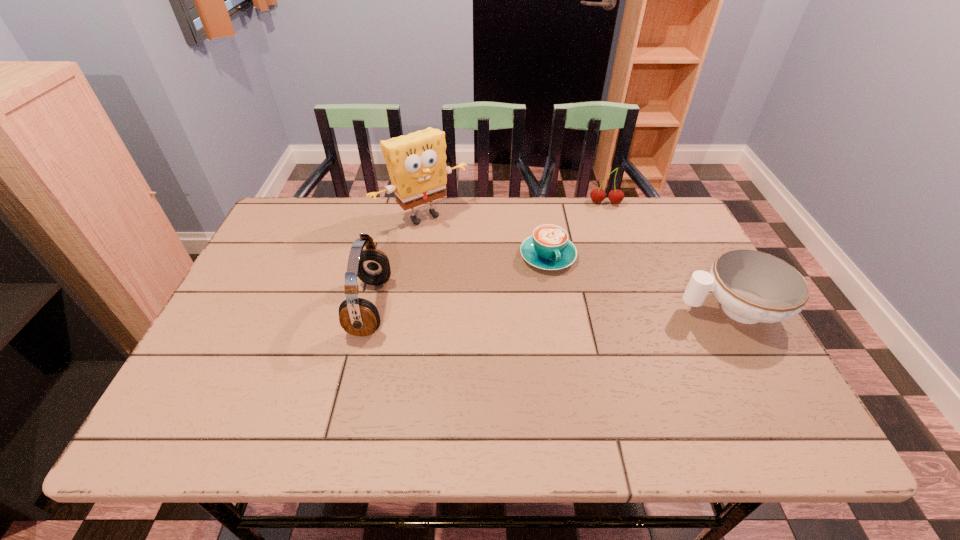
This screenshot has width=960, height=540. Find the location of `sponge that is at the far edge`. sponge that is at the far edge is located at coordinates (416, 162).

Identify the location of cappuccino that is at the far edge. The height and width of the screenshot is (540, 960). (548, 248).

You are a GUI agent. You are given a task and a screenshot of the screen. Output one action in this format:
    pyautogui.click(x=<x>, y=<y>)
    Task: Click on the cherry present at the far edge
    
    Given the screenshot: What is the action you would take?
    pyautogui.click(x=597, y=195)

At what (x,y) coordinates should I click in order to perform the action: click on object present at the right edge. Please return your answer as a coordinate pair (x, y). Looking at the image, I should click on (752, 286).

The height and width of the screenshot is (540, 960). Identify the location of blank space at the far edge. (479, 210).

Identify the location of vacant point at the near edge. Image resolution: width=960 pixels, height=540 pixels. (405, 390).

Where is `vacant space at the far right corner of the desktop`? vacant space at the far right corner of the desktop is located at coordinates (685, 237).

I want to click on vacant region between the headset and the rightmost object, so click(x=551, y=308).

Image resolution: width=960 pixels, height=540 pixels. Find the location of `vacant space in between the second tallest object and the rightmost object`. vacant space in between the second tallest object and the rightmost object is located at coordinates (551, 308).

Image resolution: width=960 pixels, height=540 pixels. Identify the location of empty space that is in between the cappuccino and the sponge. (486, 237).